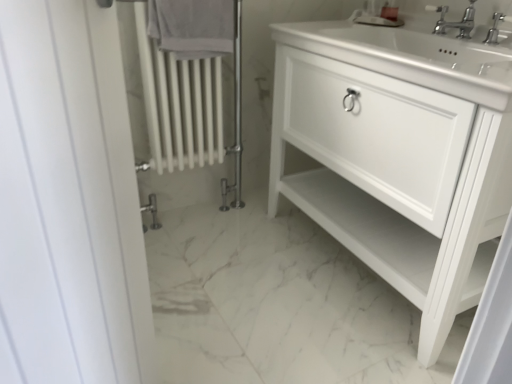
The height and width of the screenshot is (384, 512). Describe the element at coordinates (399, 155) in the screenshot. I see `white matte cabinet at center` at that location.

In order to face clear plastic soap dispenser at upper center, should I rotate leftwards or rightwards?

Turn right approximately 17.395 degrees to face it.

The width and height of the screenshot is (512, 384). What are the coordinates of `polished chrome faucet at upper right, positioned as the second tap in left-to-right order` in the screenshot? It's located at (496, 28).

This screenshot has height=384, width=512. Describe the element at coordinates (455, 22) in the screenshot. I see `polished chrome faucet at upper right, which appears as the second tap when viewed from the right` at that location.

Where is `white matte cabinet at center`? white matte cabinet at center is located at coordinates (399, 155).

Which is closer to the camera, (396, 12) or (450, 24)?

The point (450, 24) is closer to the camera.

From the clear plastic soap dispenser at upper center, count 1st taps forward and point to it. Please provide its 2D coordinates.

[(455, 22)]

How different are the orientations of clear plastic soap dispenser at upper center and polished chrome faucet at upper right, which appears as the second tap when viewed from the right, in degrees?

There is a 24.2-degree angle between the facing directions of clear plastic soap dispenser at upper center and polished chrome faucet at upper right, which appears as the second tap when viewed from the right.

From the image's perspective, is clear plastic soap dispenser at upper center on top of polished chrome faucet at upper right, marked as the first tap in a left-to-right arrangement?

Yes, from the image's perspective, clear plastic soap dispenser at upper center is above polished chrome faucet at upper right, marked as the first tap in a left-to-right arrangement.

Is the position of polished chrome faucet at upper right, the first tap viewed from the right, more distant than that of white cotton towel at upper center?

No, it is in front of white cotton towel at upper center.

Does point (495, 42) appear closer or farther from the camera than point (210, 38)?

Point (495, 42) appears to be closer to the viewer than point (210, 38).

Could white cotton towel at upper center be considered to be inside polished chrome faucet at upper right, positioned as the second tap in left-to-right order?

No, white cotton towel at upper center is not surrounded by polished chrome faucet at upper right, positioned as the second tap in left-to-right order.

Between polished chrome faucet at upper right, the first tap viewed from the right, and white cotton towel at upper center, which one has more height?

white cotton towel at upper center is taller.

Is point (497, 25) positioned after point (374, 266)?

No, it is not.

Who is taller, polished chrome faucet at upper right, positioned as the second tap in left-to-right order, or white matte cabinet at center?

white matte cabinet at center is taller.

Is there a large distance between polished chrome faucet at upper right, the first tap viewed from the right, and white matte cabinet at center?

That's not correct — polished chrome faucet at upper right, the first tap viewed from the right, is a little close to white matte cabinet at center.

Considering the relative sizes of polished chrome faucet at upper right, the first tap viewed from the right, and white matte cabinet at center in the image provided, is polished chrome faucet at upper right, the first tap viewed from the right, thinner than white matte cabinet at center?

Yes.

From the image's perspective, is white cotton towel at upper center beneath polished chrome faucet at upper right, which appears as the second tap when viewed from the right?

No.

Could you tell me if white cotton towel at upper center is facing polished chrome faucet at upper right, marked as the first tap in a left-to-right arrangement?

No, white cotton towel at upper center does not turn towards polished chrome faucet at upper right, marked as the first tap in a left-to-right arrangement.

How different are the orientations of white cotton towel at upper center and polished chrome faucet at upper right, which appears as the second tap when viewed from the right, in degrees?

The angular difference between white cotton towel at upper center and polished chrome faucet at upper right, which appears as the second tap when viewed from the right, is 91 degrees.

Can you confirm if white cotton towel at upper center is smaller than polished chrome faucet at upper right, which appears as the second tap when viewed from the right?

Actually, white cotton towel at upper center might be larger than polished chrome faucet at upper right, which appears as the second tap when viewed from the right.

Which is behind, clear plastic soap dispenser at upper center or white matte cabinet at center?

clear plastic soap dispenser at upper center is behind.

Between point (381, 14) and point (402, 84), which one is positioned in front?

The point (402, 84) is more forward.

Is clear plastic soap dispenser at upper center at the left side of white matte cabinet at center?

In fact, clear plastic soap dispenser at upper center is to the right of white matte cabinet at center.

Where is `bathroom cabinet on the left side of clear plastic soap dispenser at upper center`? This screenshot has width=512, height=384. bathroom cabinet on the left side of clear plastic soap dispenser at upper center is located at coordinates (399, 155).

Consider the image. From a real-world perspective, does white cotton towel at upper center sit lower than clear plastic soap dispenser at upper center?

Indeed, from a real-world perspective, white cotton towel at upper center is positioned beneath clear plastic soap dispenser at upper center.

From the image's perspective, which is below, white cotton towel at upper center or clear plastic soap dispenser at upper center?

white cotton towel at upper center appears lower in the image.

This screenshot has width=512, height=384. I want to click on soap dispenser above the white cotton towel at upper center (from the image's perspective), so click(390, 10).

Which object is closer to the camera taking this photo, white cotton towel at upper center or clear plastic soap dispenser at upper center?

white cotton towel at upper center is in front.

How distant is polished chrome faucet at upper right, which appears as the second tap when viewed from the right, from polished chrome faucet at upper right, positioned as the second tap in left-to-right order?

polished chrome faucet at upper right, which appears as the second tap when viewed from the right, is 4.80 inches away from polished chrome faucet at upper right, positioned as the second tap in left-to-right order.

Is polished chrome faucet at upper right, marked as the first tap in a left-to-right arrangement, facing away from polished chrome faucet at upper right, the first tap viewed from the right?

That's not correct — polished chrome faucet at upper right, marked as the first tap in a left-to-right arrangement, is not looking away from polished chrome faucet at upper right, the first tap viewed from the right.

Looking at this image, is polished chrome faucet at upper right, which appears as the second tap when viewed from the right, placed right next to polished chrome faucet at upper right, the first tap viewed from the right?

No, polished chrome faucet at upper right, which appears as the second tap when viewed from the right, is not in contact with polished chrome faucet at upper right, the first tap viewed from the right.

Between point (472, 8) and point (497, 27), which one is positioned in front?

The point (497, 27) is closer to the camera.

From the clear plastic soap dispenser at upper center, count 1st tap to the right and point to it. Please provide its 2D coordinates.

[(455, 22)]

Locate an element on the screen. This screenshot has width=512, height=384. bath towel behind the polished chrome faucet at upper right, the first tap viewed from the right is located at coordinates (192, 27).

Considering their positions, is polished chrome faucet at upper right, positioned as the second tap in left-to-right order, positioned further to polished chrome faucet at upper right, which appears as the second tap when viewed from the right, than white matte cabinet at center?

white matte cabinet at center lies further to polished chrome faucet at upper right, which appears as the second tap when viewed from the right, than the other object.

Which object lies further to the anchor point polished chrome faucet at upper right, marked as the first tap in a left-to-right arrangement, clear plastic soap dispenser at upper center or white matte cabinet at center?

white matte cabinet at center lies further to polished chrome faucet at upper right, marked as the first tap in a left-to-right arrangement, than the other object.

Which object lies nearer to the anchor point white matte cabinet at center, polished chrome faucet at upper right, marked as the first tap in a left-to-right arrangement, or clear plastic soap dispenser at upper center?

Among the two, polished chrome faucet at upper right, marked as the first tap in a left-to-right arrangement, is located nearer to white matte cabinet at center.

When comparing their distances from clear plastic soap dispenser at upper center, does polished chrome faucet at upper right, the first tap viewed from the right, or polished chrome faucet at upper right, which appears as the second tap when viewed from the right, seem closer?

polished chrome faucet at upper right, which appears as the second tap when viewed from the right, is positioned closer to the anchor clear plastic soap dispenser at upper center.

Looking at the image, which one is located closer to white matte cabinet at center, clear plastic soap dispenser at upper center or white cotton towel at upper center?

white cotton towel at upper center is closer to white matte cabinet at center.

When comparing their distances from white cotton towel at upper center, does polished chrome faucet at upper right, which appears as the second tap when viewed from the right, or white matte cabinet at center seem further?

polished chrome faucet at upper right, which appears as the second tap when viewed from the right, is further to white cotton towel at upper center.

Looking at the image, which one is located closer to polished chrome faucet at upper right, which appears as the second tap when viewed from the right, white cotton towel at upper center or clear plastic soap dispenser at upper center?

Among the two, clear plastic soap dispenser at upper center is located nearer to polished chrome faucet at upper right, which appears as the second tap when viewed from the right.

Estimate the real-world distances between objects in this image. Which object is closer to clear plastic soap dispenser at upper center, white cotton towel at upper center or white matte cabinet at center?

Among the two, white matte cabinet at center is located nearer to clear plastic soap dispenser at upper center.

The height and width of the screenshot is (384, 512). What are the coordinates of `bathroom cabinet between white cotton towel at upper center and polished chrome faucet at upper right, the first tap viewed from the right` in the screenshot? It's located at (399, 155).

Identify the location of bathroom cabinet between white cotton towel at upper center and polished chrome faucet at upper right, which appears as the second tap when viewed from the right, from left to right. The width and height of the screenshot is (512, 384). (399, 155).

What are the coordinates of `tap between polished chrome faucet at upper right, the first tap viewed from the right, and clear plastic soap dispenser at upper center from front to back` in the screenshot? It's located at (455, 22).

The image size is (512, 384). I want to click on tap between white cotton towel at upper center and polished chrome faucet at upper right, the first tap viewed from the right, so click(455, 22).